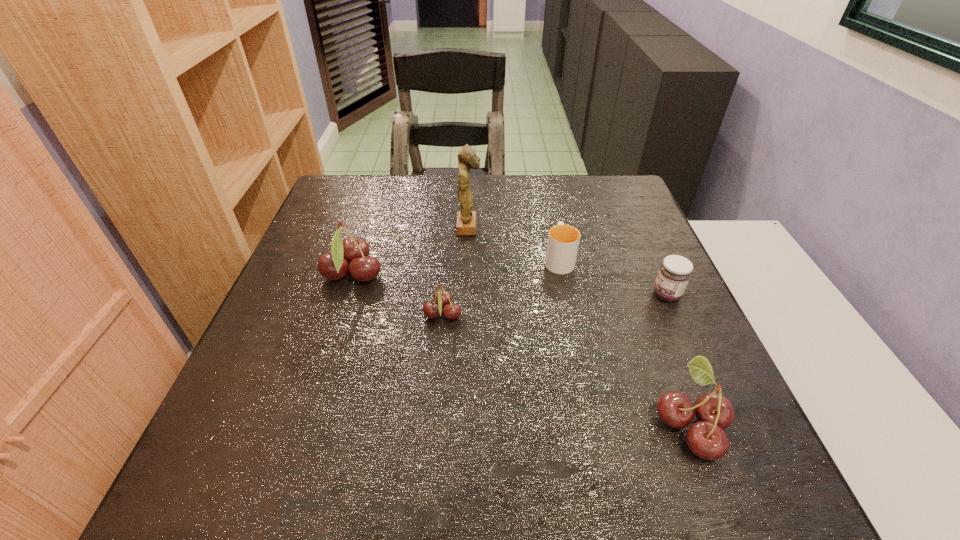
I want to click on the leftmost object, so click(334, 266).

This screenshot has width=960, height=540. In order to click on the shortest cherry in this screenshot , I will do `click(442, 298)`.

This screenshot has width=960, height=540. Identify the location of the nearest cherry. (706, 438).

Find the location of a particular element. the nearest object is located at coordinates coord(706,438).

In order to click on the tallest object in this screenshot , I will do `click(467, 159)`.

Find the location of `figurine`. figurine is located at coordinates (467, 159).

Where is `jam`? This screenshot has width=960, height=540. jam is located at coordinates (674, 274).

You are a GUI agent. You are given a task and a screenshot of the screen. Output one action in this format:
    pyautogui.click(x=<x>, y=<y>)
    Task: Click on the cup
    Image resolution: width=960 pixels, height=540 pixels.
    Given the screenshot: What is the action you would take?
    pyautogui.click(x=563, y=240)

This screenshot has width=960, height=540. I want to click on vacant space located on the leaves of the leftmost object, so click(516, 275).

The width and height of the screenshot is (960, 540). Identify the location of free location located on the leaves of the shortest cherry. (518, 314).